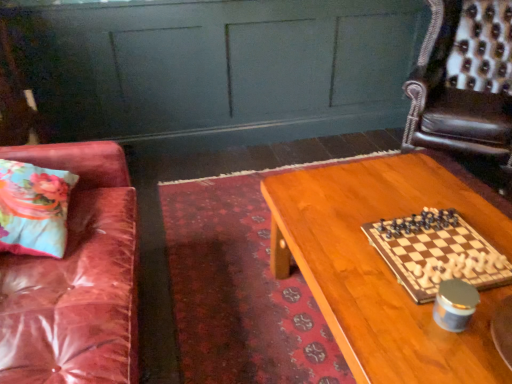
Question: Is floral fabric pillow at left aimed at wooden table at center?

Choices:
 (A) no
 (B) yes

Answer: (B)

Question: Is floral fabric pillow at left positioned beyond the bounds of wooden table at center?

Choices:
 (A) yes
 (B) no

Answer: (A)

Question: From a real-world perspective, does floral fabric pillow at left stand above wooden table at center?

Choices:
 (A) yes
 (B) no

Answer: (A)

Question: Is floral fabric pillow at left shorter than wooden table at center?

Choices:
 (A) yes
 (B) no

Answer: (A)

Question: Is wooden table at center located within floral fabric pillow at left?

Choices:
 (A) yes
 (B) no

Answer: (B)

Question: Is point (381, 87) positioned closer to the camera than point (352, 274)?

Choices:
 (A) farther
 (B) closer

Answer: (A)

Question: Considering the positions of matte green dresser at upper center and wooden table at center in the image, is matte green dresser at upper center taller or shorter than wooden table at center?

Choices:
 (A) tall
 (B) short

Answer: (A)

Question: Would you say matte green dresser at upper center is inside or outside wooden table at center?

Choices:
 (A) inside
 (B) outside

Answer: (B)

Question: Looking at the image, does matte green dresser at upper center seem bigger or smaller compared to wooden table at center?

Choices:
 (A) big
 (B) small

Answer: (B)

Question: Looking at their shapes, would you say leather armchair at upper right is wider or thinner than floral fabric pillow at left?

Choices:
 (A) thin
 (B) wide

Answer: (B)

Question: Would you say leather armchair at upper right is inside or outside floral fabric pillow at left?

Choices:
 (A) inside
 (B) outside

Answer: (B)

Question: From a real-world perspective, relative to floral fabric pillow at left, is leather armchair at upper right vertically above or below?

Choices:
 (A) below
 (B) above

Answer: (A)

Question: From the image's perspective, is leather armchair at upper right positioned above or below floral fabric pillow at left?

Choices:
 (A) above
 (B) below

Answer: (A)

Question: Is matte green dresser at upper center inside or outside of floral fabric pillow at left?

Choices:
 (A) inside
 (B) outside

Answer: (B)

Question: Does point (96, 4) appear closer or farther from the camera than point (12, 200)?

Choices:
 (A) farther
 (B) closer

Answer: (A)